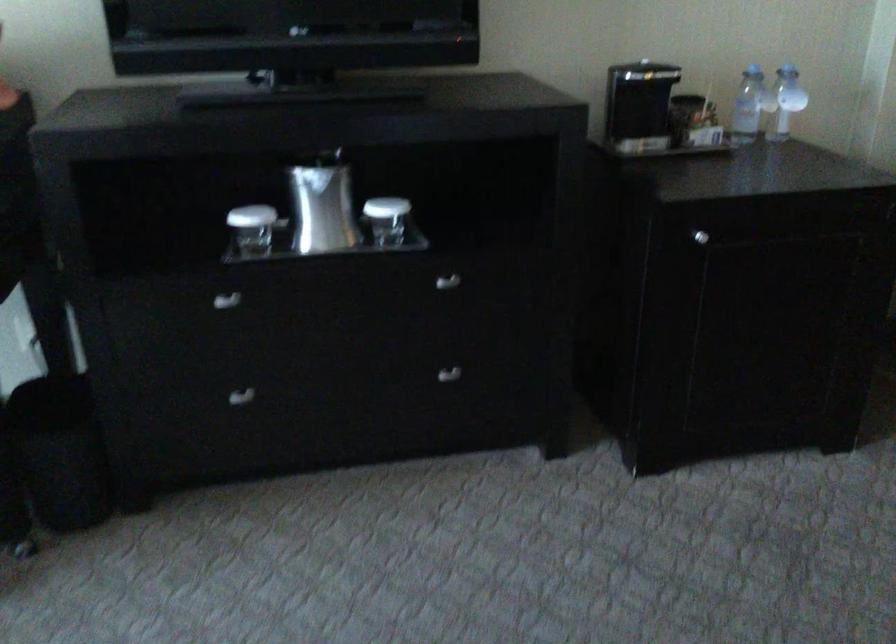
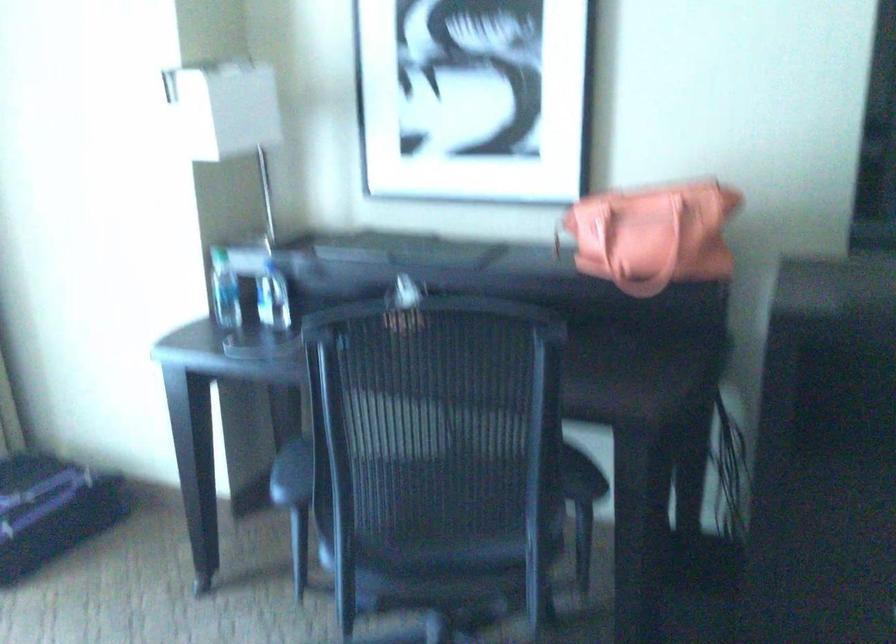
Question: Based on the continuous images, in which direction is the camera rotating? Reply with the corresponding letter.

Choices:
 (A) Left
 (B) Right
 (C) Up
 (D) Down

Answer: (A)